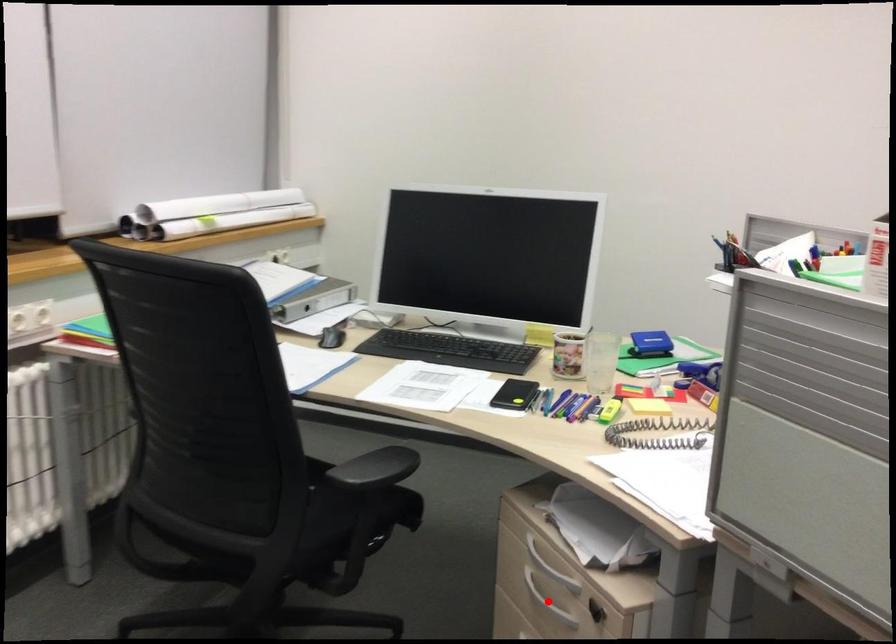
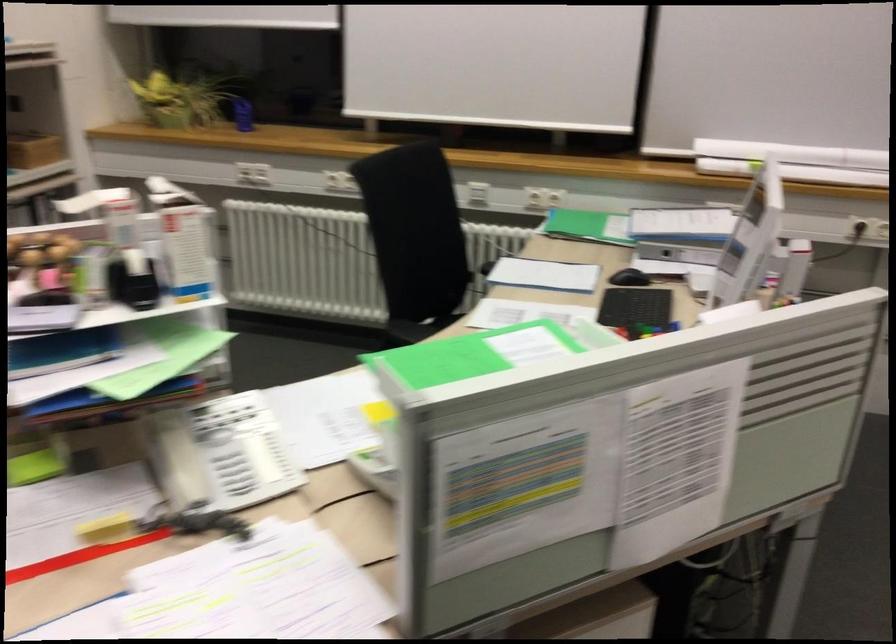
Question: I am providing you with two images of the same scene from different viewpoints. A red point is marked on the first image. Can you still see the location of the red point in image 2?

Choices:
 (A) Yes
 (B) No

Answer: (B)